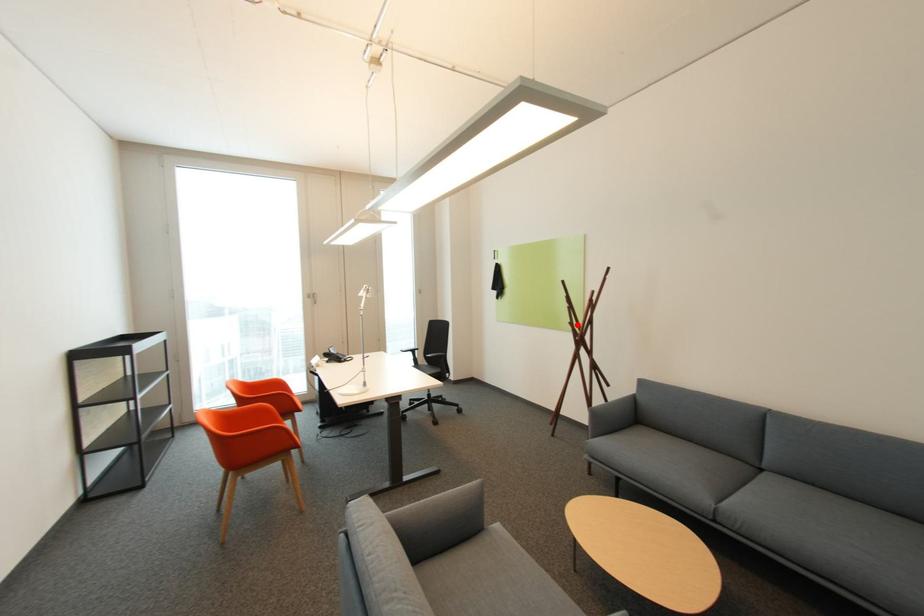
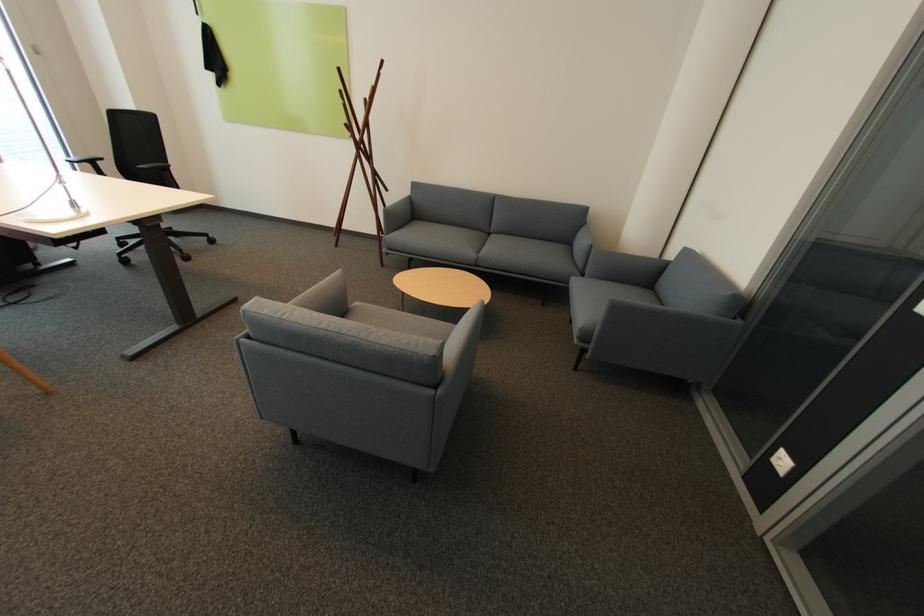
Question: I am providing you with two images of the same scene from different viewpoints. A red point is shown in image1. For the corresponding object point in image2, is it positioned nearer or farther from the camera?

Choices:
 (A) Nearer
 (B) Farther

Answer: (B)